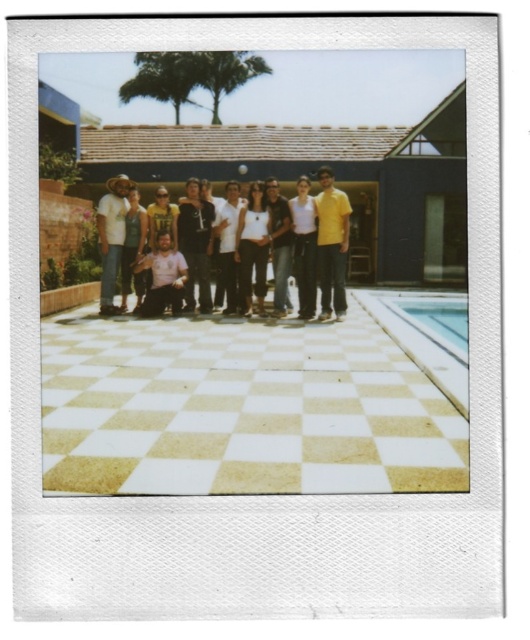
Based on the scene description, where is the matte black shirt at center located in terms of coordinates?

The matte black shirt at center is located at coordinates point (269, 243).

You are a photographer trying to capture a group photo of the dark gray hoodie at center and the matte white shirt at left. Based on their positions, which subject is standing more to the left?

The matte white shirt at left is more to the left since the dark gray hoodie at center is positioned to its right.